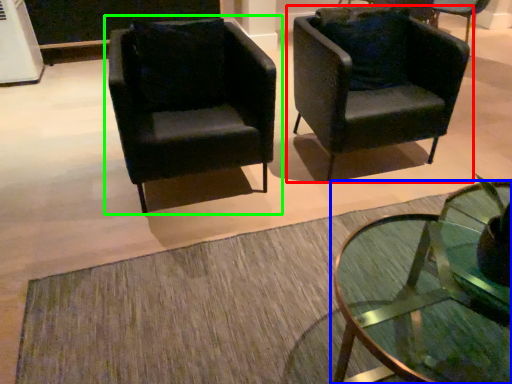
Question: Which object is positioned closest to chair (highlighted by a red box)? Select from coffee table (highlighted by a blue box) and chair (highlighted by a green box).

Choices:
 (A) coffee table
 (B) chair

Answer: (B)